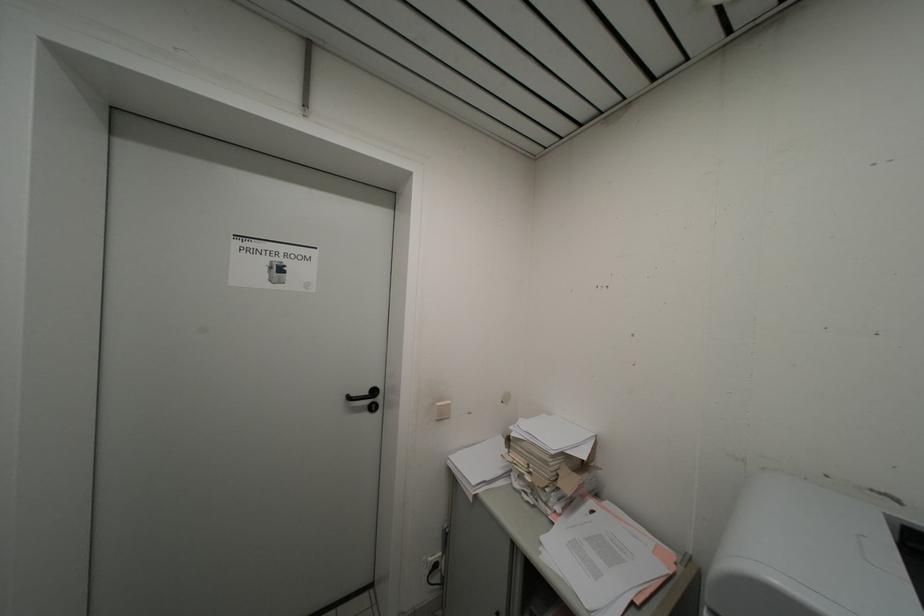
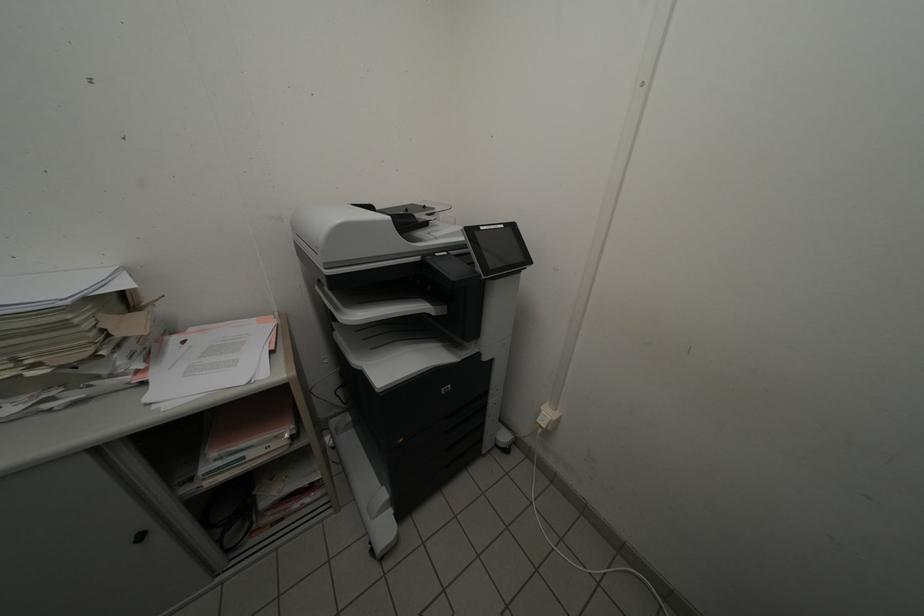
Based on the continuous images, in which direction is the camera rotating?

The rotation direction of the camera is right-down.